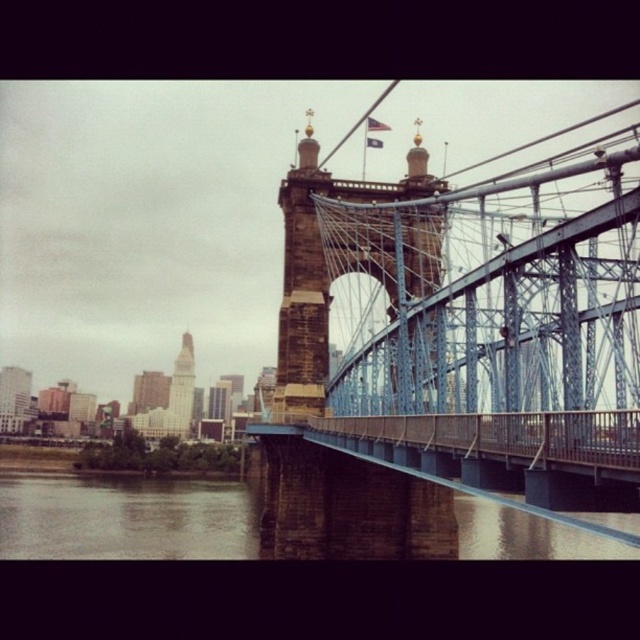
You are standing at the point marked by coordinates point (472, 321). What structure are you currently on?

The point (472, 321) corresponds to the blue steel suspension bridge at center, so you are currently on the blue steel suspension bridge at center.